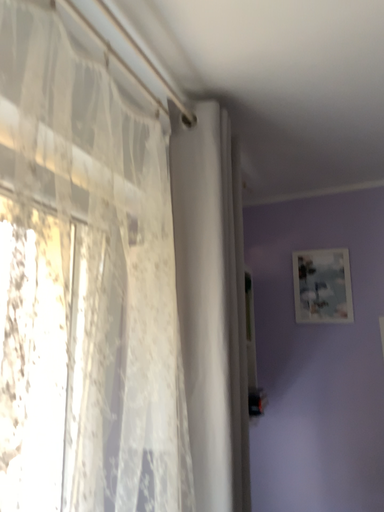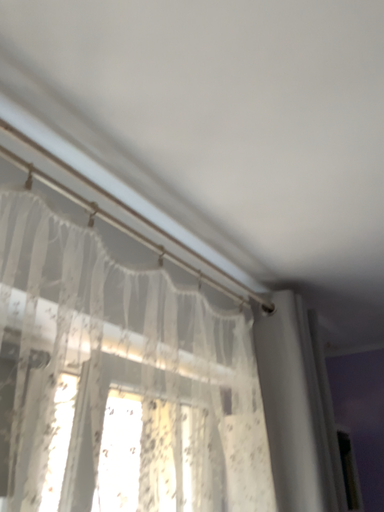
Question: Which way did the camera rotate in the video?

Choices:
 (A) rotated downward
 (B) rotated upward

Answer: (B)